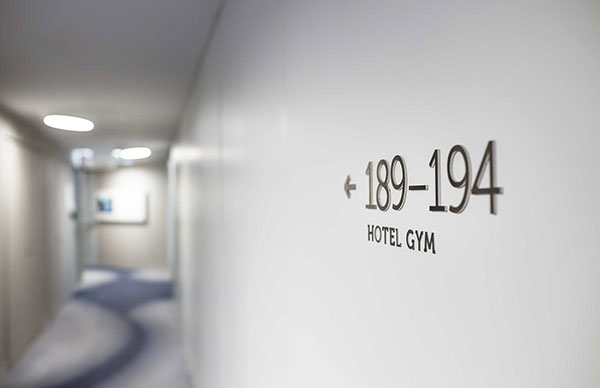
Where is `dark blue diamond on floor`? The image size is (600, 388). dark blue diamond on floor is located at coordinates (127, 299).